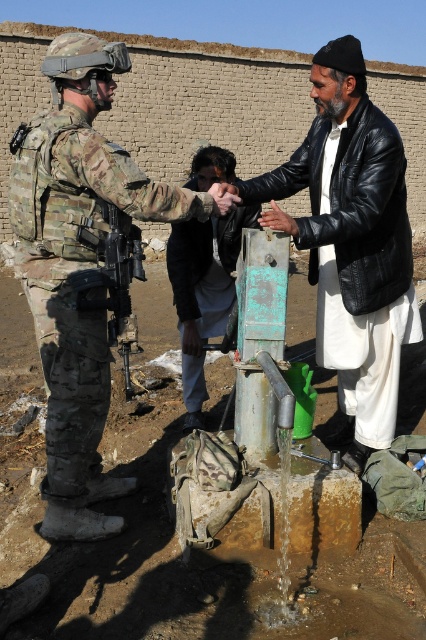
You are a drone operator trying to deliver a small package to the soldier in the dark brown leather jacket at center. The drone has a GPS that can only target coordinates within 0.5 units of the jacket. Can the drone deliver the package to the jacket?

The dark brown leather jacket at center is located at point (204,291). Since the drone can target within 0.5 units, the distance is within range, so yes, the drone can deliver the package to the jacket.